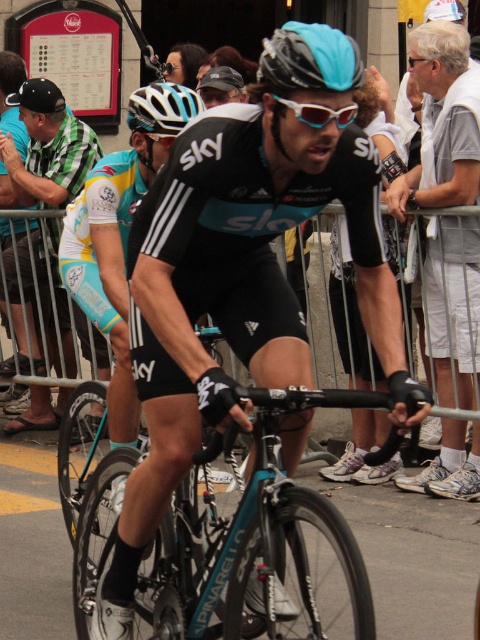
You are a photographer at the cycling race and want to capture a closeup of the cyclist. The camera you are using has a limited field of view. Which object, the teal matte helmet at upper center or the light brown hair at upper center, would you focus on to ensure it takes up more of the frame?

The light brown hair at upper center occupies more space than the teal matte helmet at upper center, so focusing on the light brown hair at upper center would ensure it takes up more of the frame.

You are a photographer positioned at the side of the race track. You want to capture a photo of the cyclist while ensuring both the teal matte helmet at upper center and the white translucent goggles at center are clearly visible. Do you need to adjust your camera angle to accommodate their widths?

The teal matte helmet at upper center might be wider than white translucent goggles at center, so adjusting the camera angle might be necessary to ensure both are fully visible in the frame.